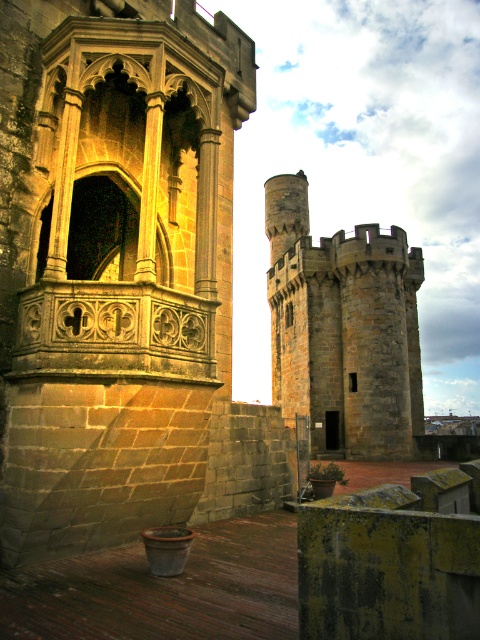
Is stone carved balcony at center smaller than stone tower at center?

Indeed, stone carved balcony at center has a smaller size compared to stone tower at center.

Is stone carved balcony at center to the right of stone tower at center from the viewer's perspective?

In fact, stone carved balcony at center is to the left of stone tower at center.

Describe the element at coordinates (119, 273) in the screenshot. I see `stone carved balcony at center` at that location.

The width and height of the screenshot is (480, 640). Identify the location of stone carved balcony at center. (119, 273).